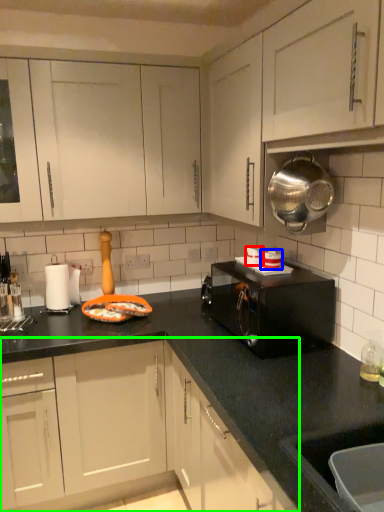
Question: Which is farther away from appliance (highlighted by a red box)? appliance (highlighted by a blue box) or cabinetry (highlighted by a green box)?

Choices:
 (A) appliance
 (B) cabinetry

Answer: (B)